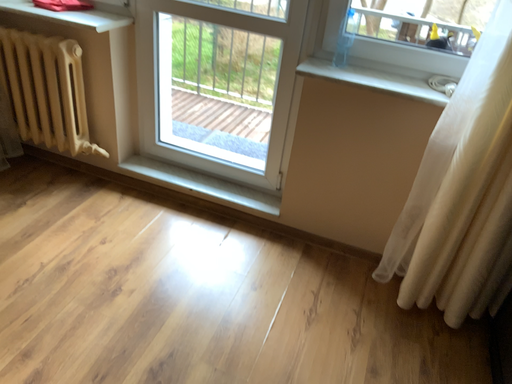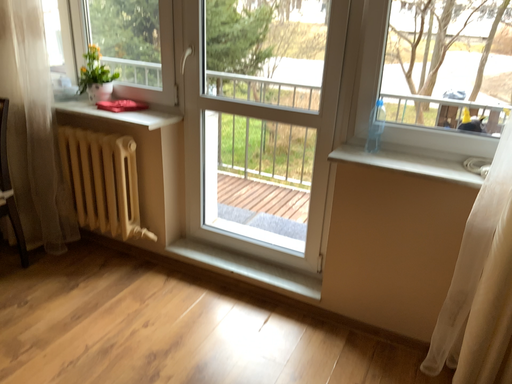
Question: How did the camera likely rotate when shooting the video?

Choices:
 (A) rotated left
 (B) rotated right

Answer: (A)